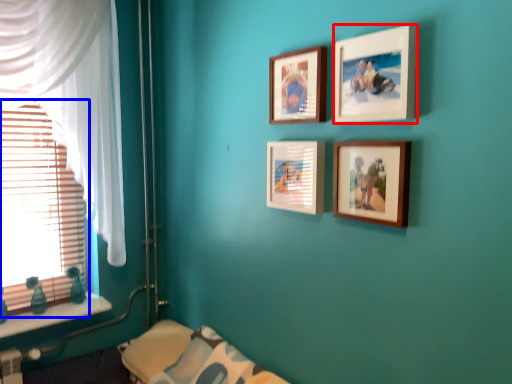
Question: Which of the following is the farthest to the observer, picture frame (highlighted by a red box) or window blind (highlighted by a blue box)?

Choices:
 (A) picture frame
 (B) window blind

Answer: (B)